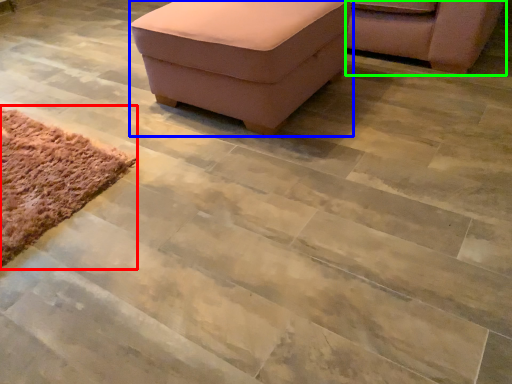
Question: Estimate the real-world distances between objects in this image. Which object is farther from mat (highlighted by a red box), furniture (highlighted by a blue box) or chair (highlighted by a green box)?

Choices:
 (A) furniture
 (B) chair

Answer: (B)